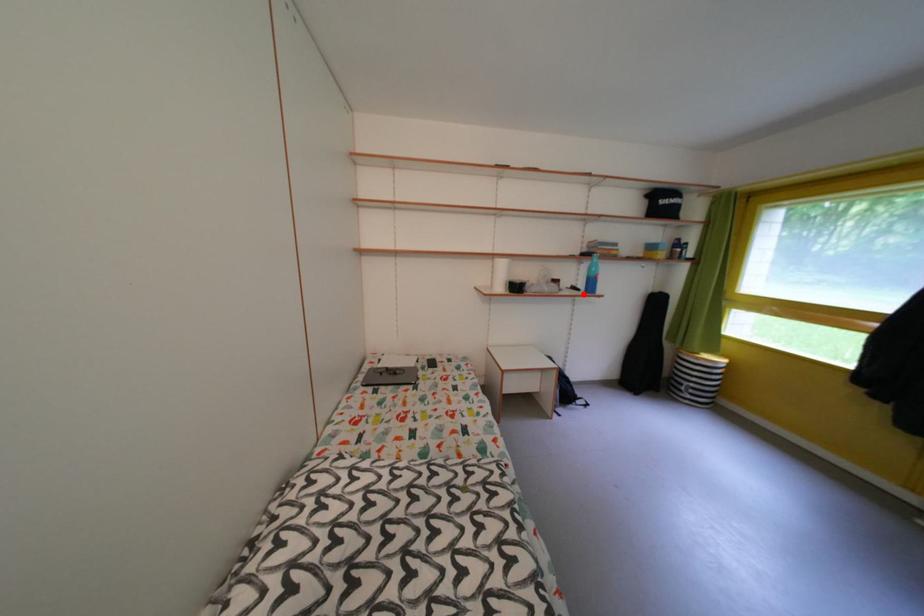
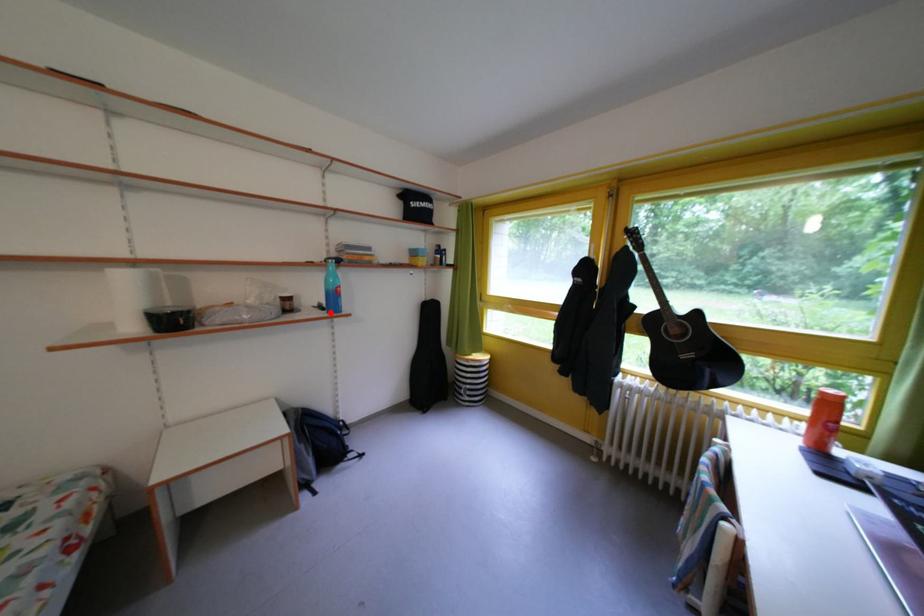
I am providing you with two images of the same scene from different viewpoints. A red point is marked on the first image and another point is marked on the second image. Is the marked point in image1 the same physical position as the marked point in image2?

Yes